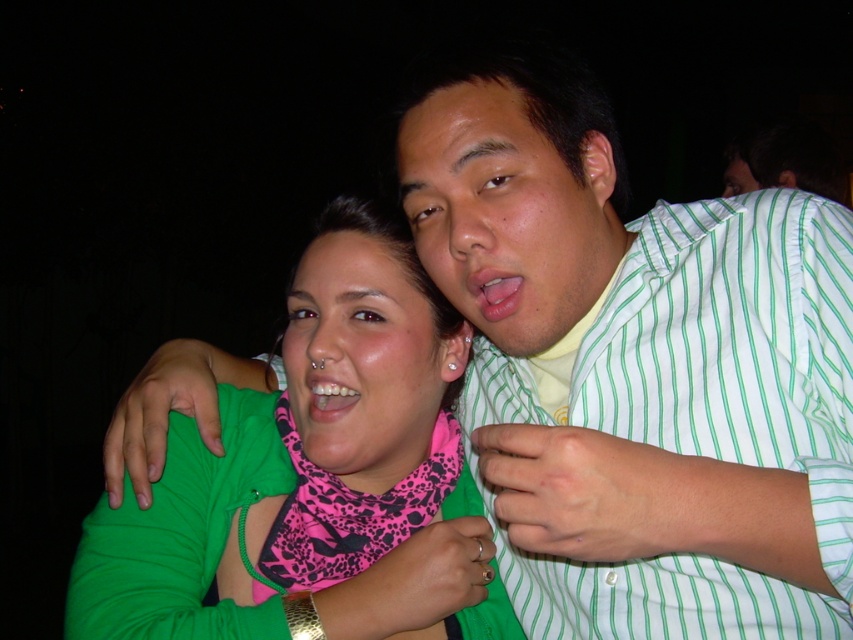
Is green striped shirt at upper right closer to camera compared to pink matte scarf at center?

Yes, green striped shirt at upper right is closer to the viewer.

The width and height of the screenshot is (853, 640). What do you see at coordinates (699, 410) in the screenshot?
I see `green striped shirt at upper right` at bounding box center [699, 410].

Where is `green striped shirt at upper right`? Image resolution: width=853 pixels, height=640 pixels. green striped shirt at upper right is located at coordinates (699, 410).

Which is in front, point (289, 442) or point (509, 145)?

Positioned in front is point (509, 145).

Is green fabric at center wider than pink matte scarf at center?

Yes.

Is point (428, 422) positioned in front of point (473, 276)?

No, it is not.

Identify the location of green fabric at center. (315, 477).

Between green fabric at center and matte green shirt at center, which one appears on the left side from the viewer's perspective?

Positioned to the left is green fabric at center.

Is point (434, 369) closer to viewer compared to point (585, 161)?

No, it is behind (585, 161).

Describe the element at coordinates (315, 477) in the screenshot. I see `green fabric at center` at that location.

At what (x,y) coordinates should I click in order to perform the action: click on green fabric at center. Please return your answer as a coordinate pair (x, y). The image size is (853, 640). Looking at the image, I should click on (315, 477).